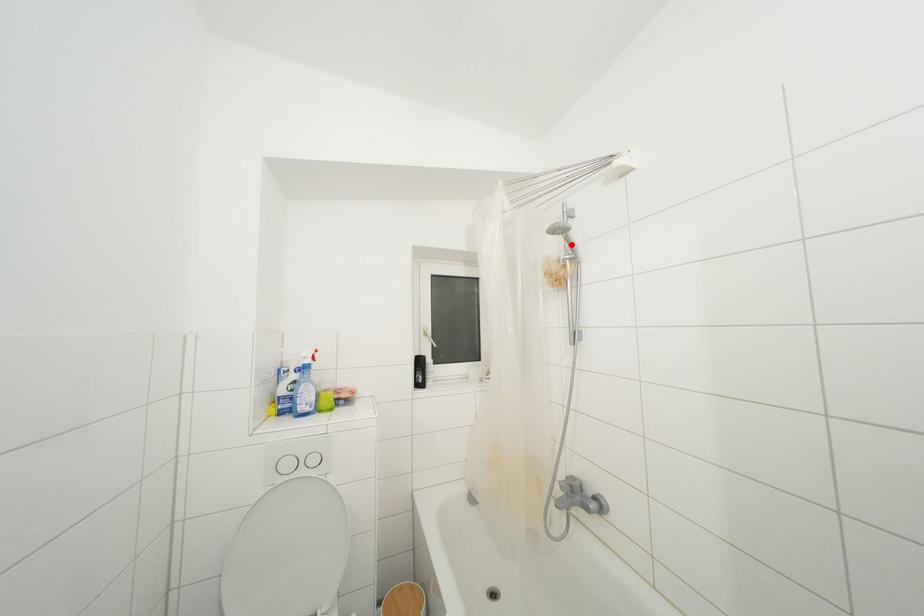
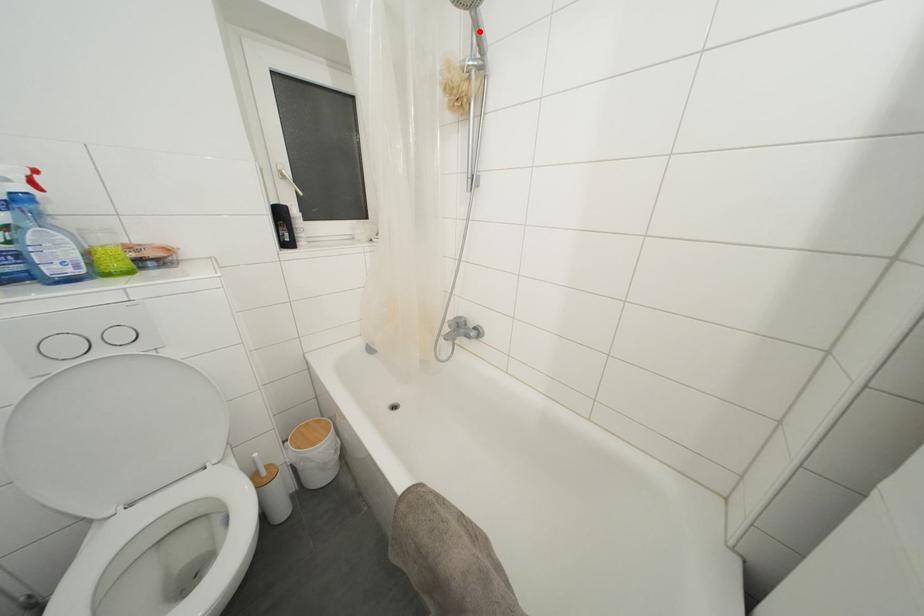
I am providing you with two images of the same scene from different viewpoints. A red point is marked on the first image and another point is marked on the second image. Does the point marked in image1 correspond to the same location as the one in image2?

Yes